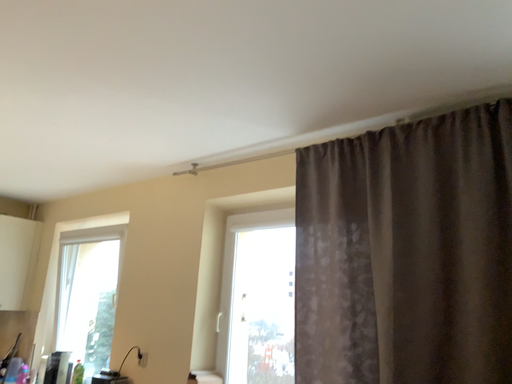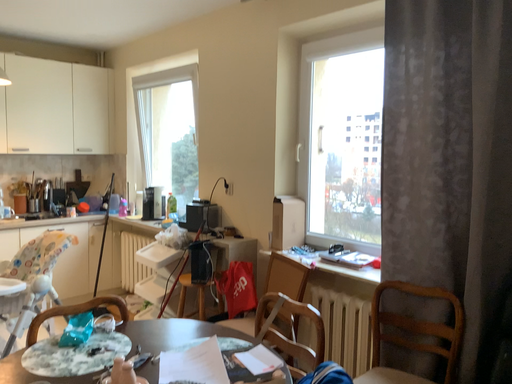
Question: Which way did the camera rotate in the video?

Choices:
 (A) rotated downward
 (B) rotated upward

Answer: (A)